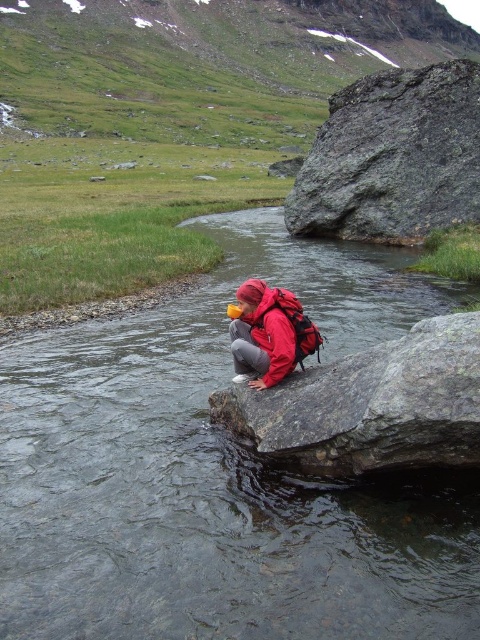
Which of these two, clear water stream at center or gray rough rock at upper right, stands taller?

With more height is gray rough rock at upper right.

Who is positioned more to the right, clear water stream at center or gray rough rock at upper right?

gray rough rock at upper right

Between point (68, 627) and point (393, 84), which one is positioned behind?

Positioned behind is point (393, 84).

Find the location of a particular element. clear water stream at center is located at coordinates (217, 474).

Is point (235, 616) closer to camera compared to point (396, 396)?

That is True.

Is clear water stream at center smaller than smooth gray rock at center?

Incorrect, clear water stream at center is not smaller in size than smooth gray rock at center.

You are a GUI agent. You are given a task and a screenshot of the screen. Output one action in this format:
    pyautogui.click(x=<x>, y=<y>)
    Task: Click on the clear water stream at center
    
    Given the screenshot: What is the action you would take?
    pyautogui.click(x=217, y=474)

Between smooth gray rock at center and gray rough rock at upper right, which one is positioned higher?

gray rough rock at upper right is above.

Is smooth gray rock at center taller than gray rough rock at upper right?

No.

Who is more distant from viewer, (415, 353) or (402, 76)?

Point (402, 76)

The width and height of the screenshot is (480, 640). Find the location of `smooth gray rock at center`. smooth gray rock at center is located at coordinates (370, 406).